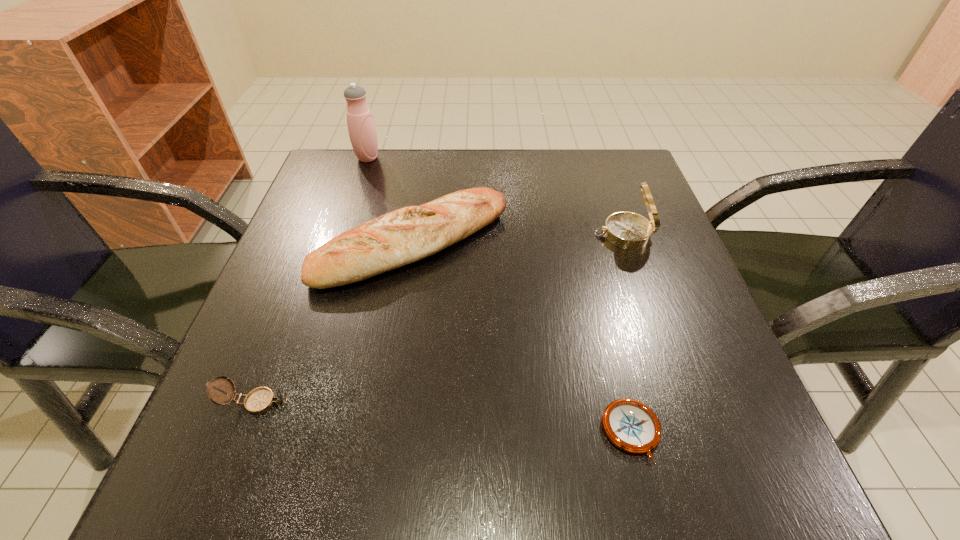
Select which object appears as the fourth closest to the farthest object. Please provide its 2D coordinates. Your answer should be formatted as a tuple, i.e. [(x, y)], where the tuple contains the x and y coordinates of a point satisfying the conditions above.

[(632, 426)]

Where is `the closest compass to the baguet`? The width and height of the screenshot is (960, 540). the closest compass to the baguet is located at coordinates (627, 230).

Find the location of a particular element. compass that is the closest to the farthest object is located at coordinates (627, 230).

I want to click on free space in the image that satisfies the following two spatial constraints: 1. on the face of the shortest object; 2. on the left side of the second shortest object, so click(x=244, y=432).